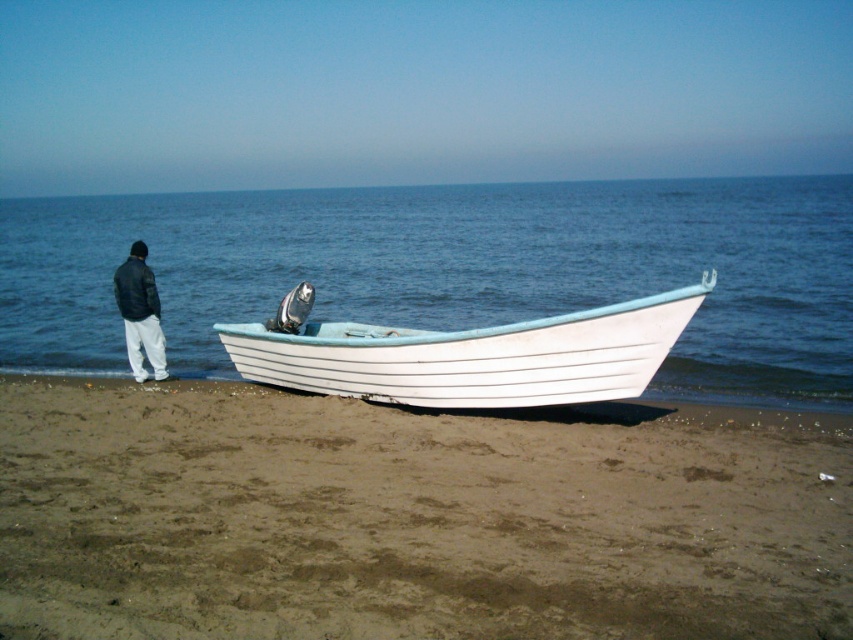
You are standing on the beach and see the white wood boat at center and the black leather jacket at left. Which object is closer to the water?

The white wood boat at center is closer to the water because it is positioned to the right of the black leather jacket at left, and since the water is at the edge of the shore, the boat being further right would be nearer to the water.

You are standing on the beach and want to take a photo of both point (691, 310) and point (136, 276) in the scene. Which point should you focus on first to ensure both are in clear view?

You should focus on point (691, 310) first because it is closer to the camera than point (136, 276), ensuring both points are in focus.